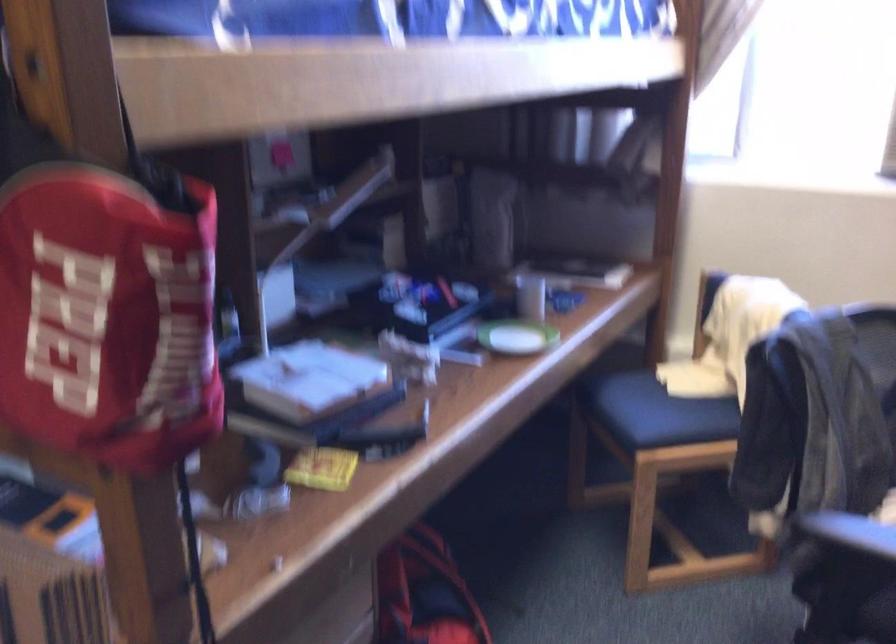
Locate an element on the screen. The height and width of the screenshot is (644, 896). chair sitting surface is located at coordinates (668, 415).